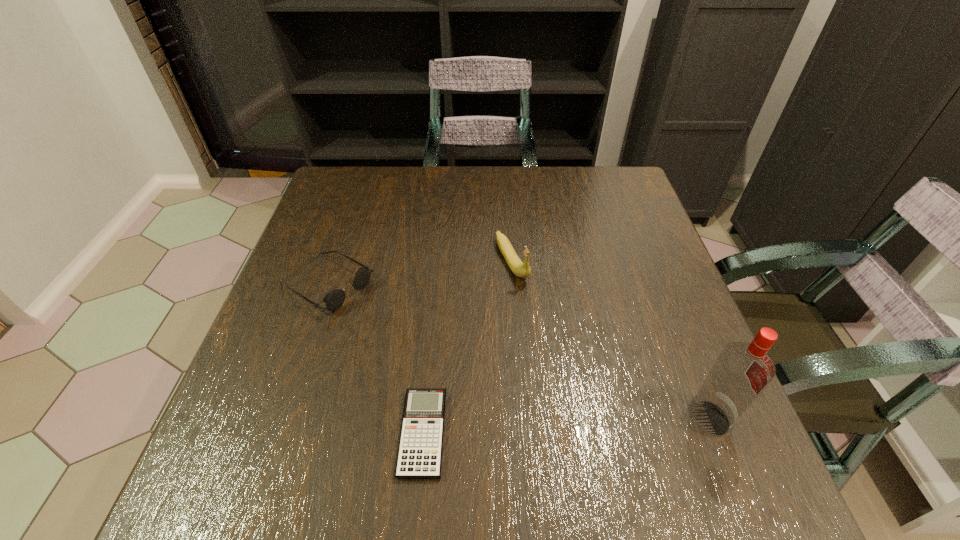
Identify the location of the third object from right to left. (420, 449).

In order to click on the shortest object in this screenshot , I will do `click(420, 449)`.

Find the location of a particular element. This screenshot has width=960, height=540. the rightmost object is located at coordinates (742, 371).

Where is `vodka`? This screenshot has height=540, width=960. vodka is located at coordinates (742, 371).

Find the location of `sunglasses`. sunglasses is located at coordinates [334, 299].

In order to click on the leftmost object in this screenshot , I will do `click(334, 299)`.

Where is `the second tallest object`? The width and height of the screenshot is (960, 540). the second tallest object is located at coordinates (520, 269).

Locate an element on the screen. This screenshot has width=960, height=540. the second object from right to left is located at coordinates (520, 269).

The image size is (960, 540). Identify the location of free spot located 0.370m on the right of the third object from right to left. (659, 433).

You are a GUI agent. You are given a task and a screenshot of the screen. Output one action in this format:
    pyautogui.click(x=<x>, y=<y>)
    Task: Click on the free location located on the front-facing side of the leftmost object
    The height and width of the screenshot is (540, 960).
    Given the screenshot: What is the action you would take?
    pyautogui.click(x=481, y=375)